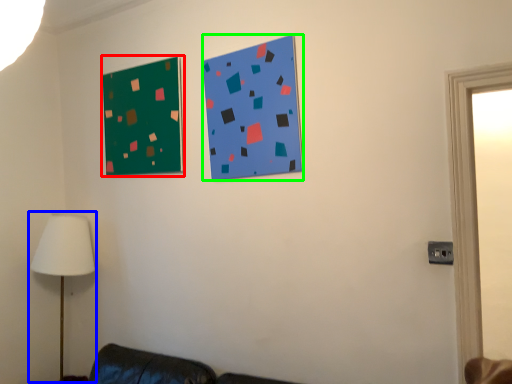
Question: Estimate the real-world distances between objects in this image. Which object is closer to bulletin board (highlighted by a red box), table lamp (highlighted by a blue box) or bulletin board (highlighted by a green box)?

Choices:
 (A) table lamp
 (B) bulletin board

Answer: (B)